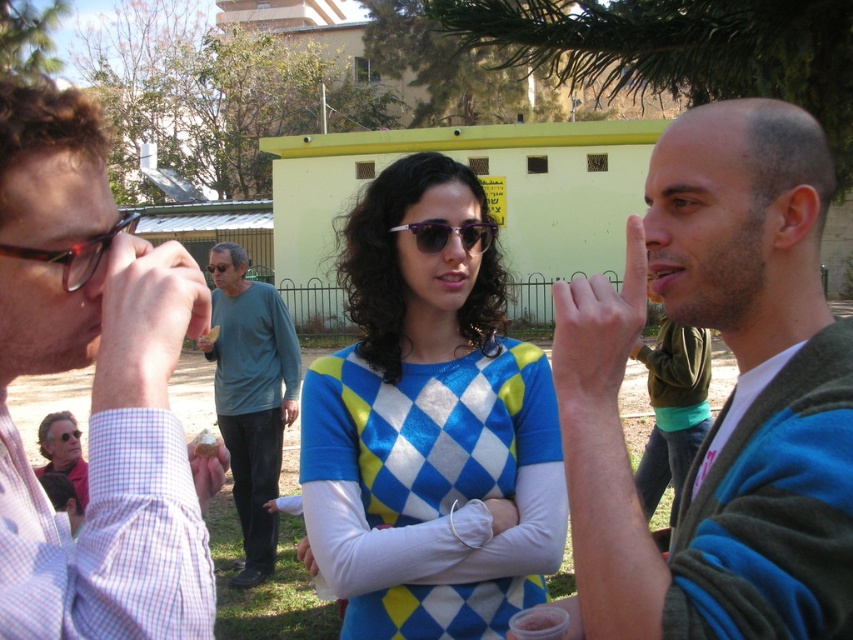
You are a photographer trying to capture a candid shot of the blue sweater at center without being noticed. The camera you are using has a minimum focusing distance of 1 meter. Can you take the photo from your current position?

The blue sweater at center and camera are 88.81 centimeters apart. Since the minimum focusing distance is 1 meter, the camera cannot focus at that distance. You need to move back to at least 1 meter away to take the photo.